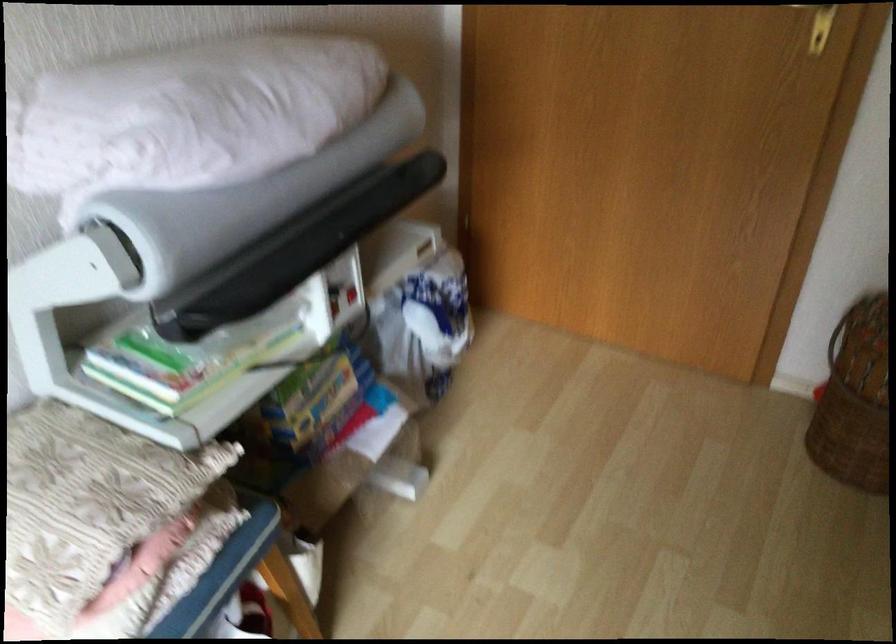
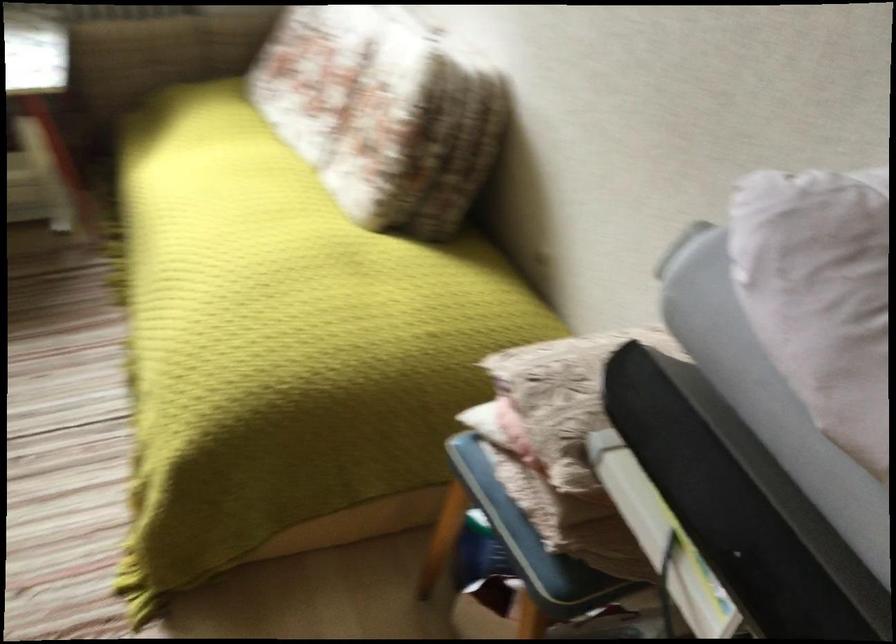
Locate, in the second image, the point that corresponds to the point at 236,556 in the first image.

(528, 534)